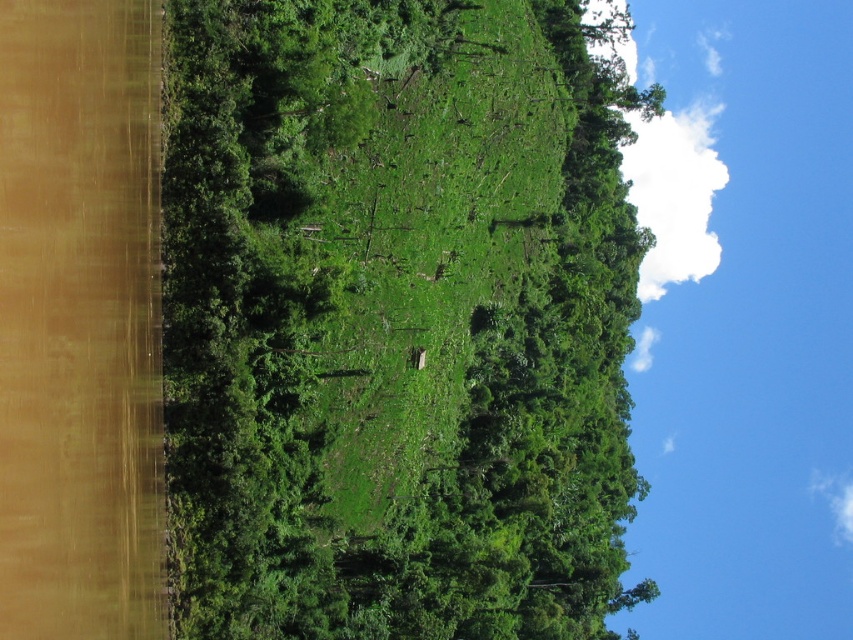
Question: Is green leafy tree at center bigger than green grassy field at center?

Choices:
 (A) yes
 (B) no

Answer: (A)

Question: Observing the image, what is the correct spatial positioning of green leafy tree at center in reference to green grassy field at center?

Choices:
 (A) left
 (B) right

Answer: (B)

Question: Which point is closer to the camera?

Choices:
 (A) (634, 257)
 (B) (419, 173)

Answer: (B)

Question: Which point is farther to the camera?

Choices:
 (A) green leafy tree at center
 (B) green grassy field at center

Answer: (B)

Question: Which of the following is the farthest from the observer?

Choices:
 (A) green grassy field at center
 (B) green leafy tree at center

Answer: (A)

Question: Is the position of green leafy tree at center more distant than that of green grassy field at center?

Choices:
 (A) yes
 (B) no

Answer: (B)